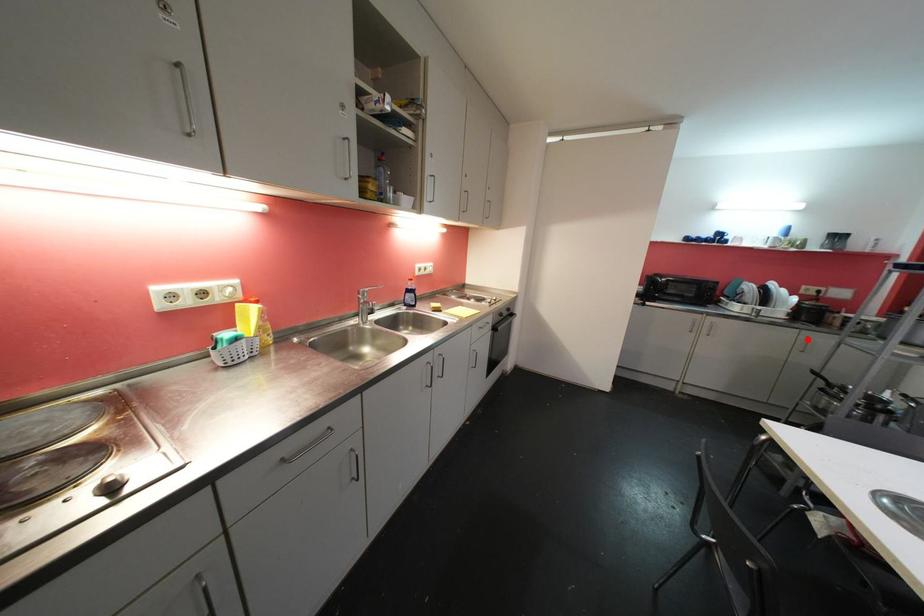
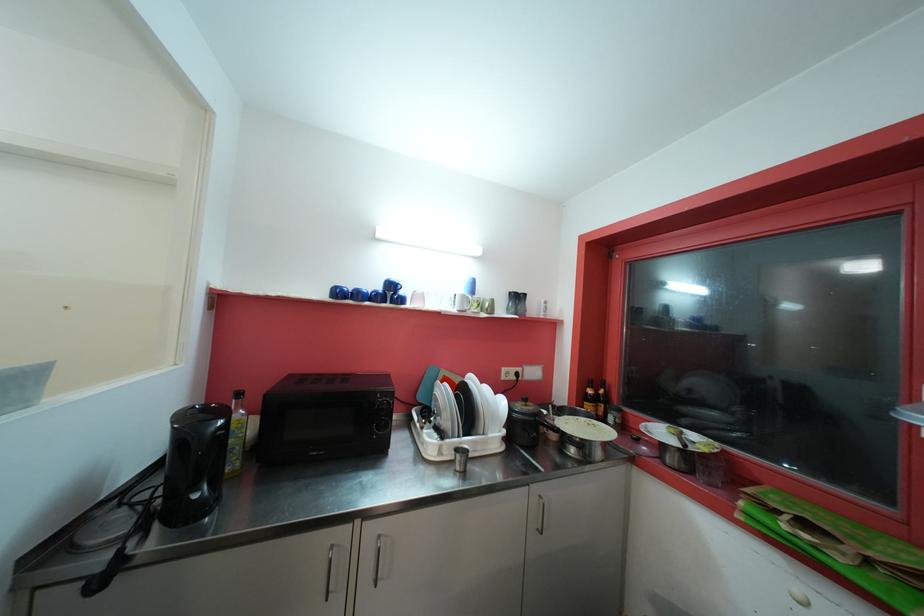
Where in the second image is the point corresponding to the highlighted location from the first image?

(540, 501)